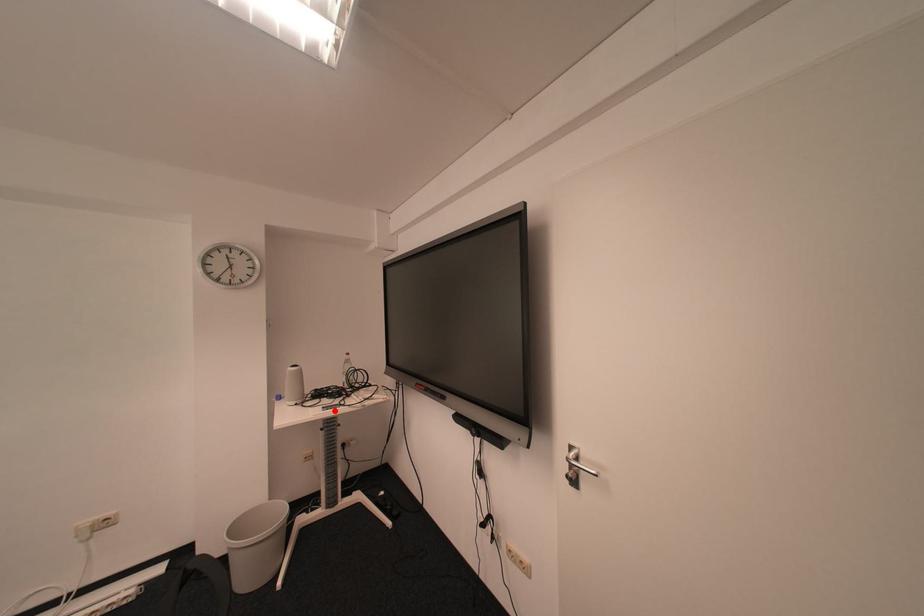
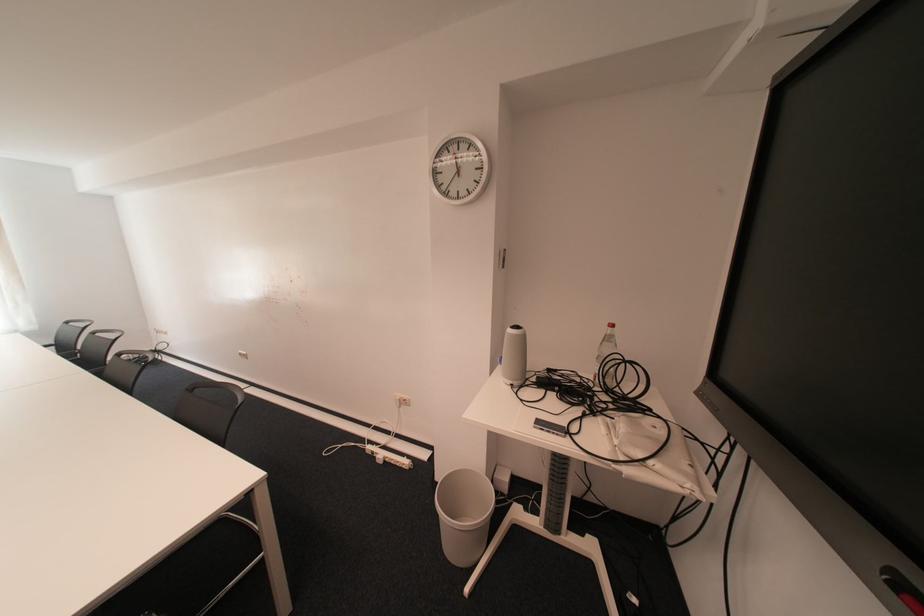
Where in the second image is the point corresponding to the highlighted location from the first image?

(545, 428)